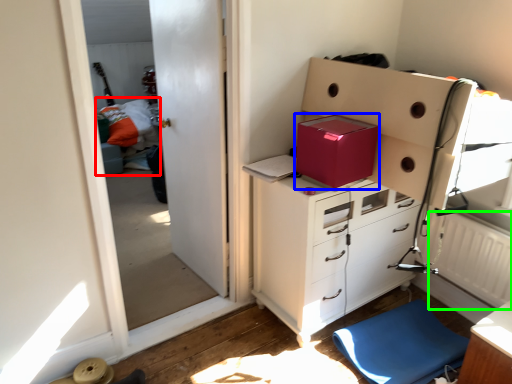
Question: Estimate the real-world distances between objects in this image. Which object is closer to bed (highlighted by a red box), cardboard box (highlighted by a blue box) or radiator (highlighted by a green box)?

Choices:
 (A) cardboard box
 (B) radiator

Answer: (A)